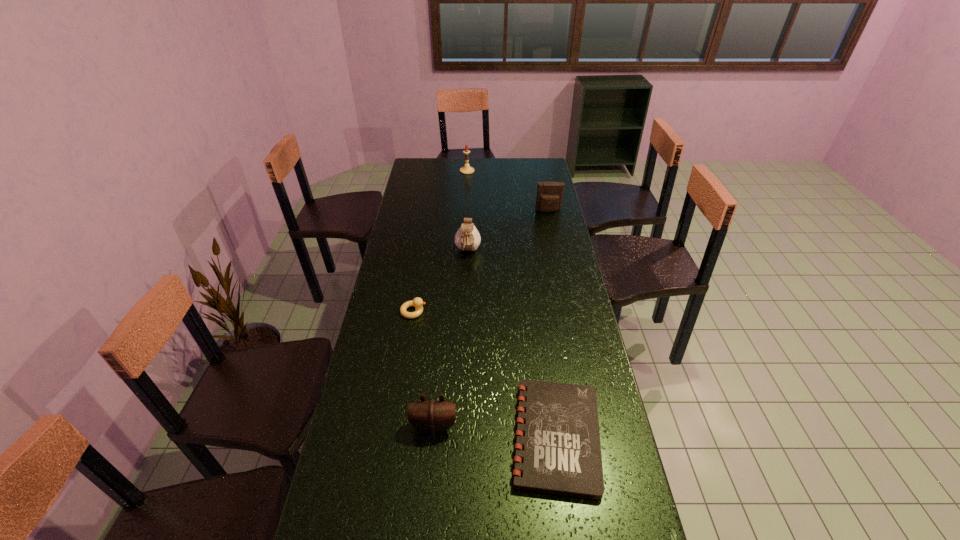
Locate an element on the screen. This screenshot has width=960, height=540. free space that satisfies the following two spatial constraints: 1. with the flap open on the notebook; 2. on the left side of the fourth tallest object is located at coordinates (433, 436).

Image resolution: width=960 pixels, height=540 pixels. I want to click on free location that satisfies the following two spatial constraints: 1. with the flap open on the shortest object; 2. on the left side of the shortest pouch, so click(433, 436).